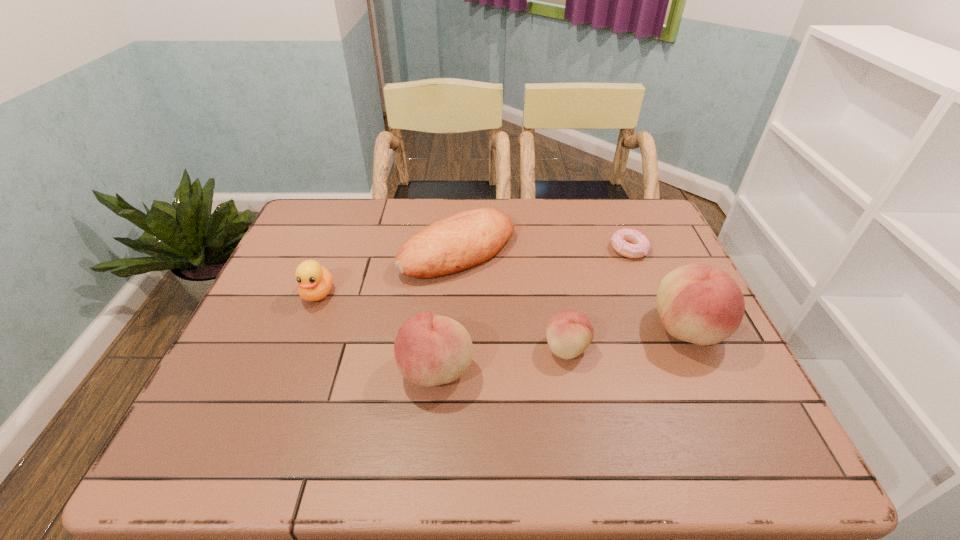
Given the evenly spaced peachs in the image, where should an extra peach be added on the left to preserve the spacing? Please point to a vacant space. Please provide its 2D coordinates. Your answer should be formatted as a tuple, i.e. [(x, y)], where the tuple contains the x and y coordinates of a point satisfying the conditions above.

[(293, 393)]